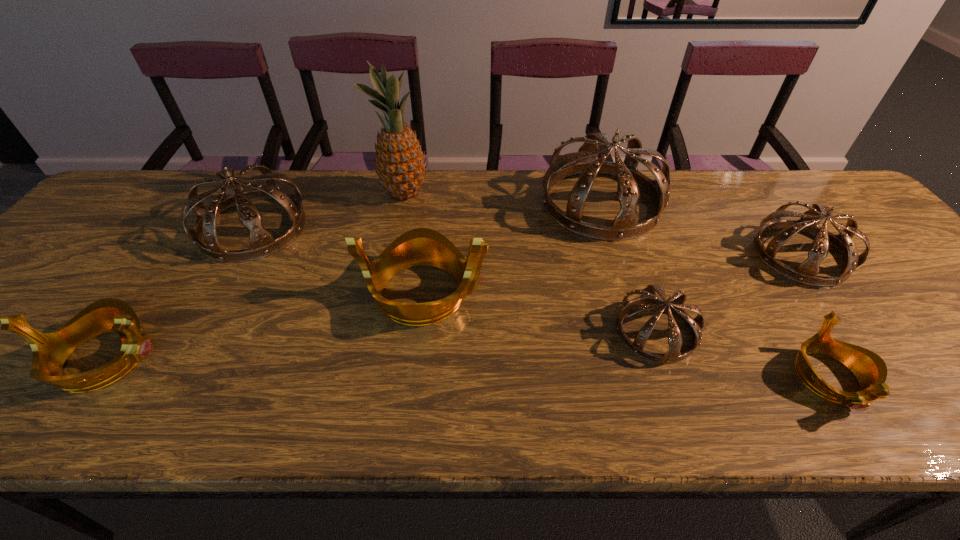
Locate an element on the screen. the rightmost gold tiara is located at coordinates (869, 368).

Locate an element on the screen. The image size is (960, 540). vacant space located on the left of the pineapple is located at coordinates (281, 194).

The height and width of the screenshot is (540, 960). I want to click on vacant space located on the front of the seventh shortest object, so click(621, 268).

Where is `free space located on the left of the leftmost brown tiara`? The width and height of the screenshot is (960, 540). free space located on the left of the leftmost brown tiara is located at coordinates (92, 228).

Locate an element on the screen. The width and height of the screenshot is (960, 540). vacant space located 0.240m at the front emblem of the biggest gold tiara is located at coordinates (590, 292).

The image size is (960, 540). Identify the location of vacant region located on the front of the rightmost brown tiara. (858, 333).

Find the location of a particular element. free point located at the front emblem of the leftmost gold tiara is located at coordinates (212, 358).

You are a GUI agent. You are given a task and a screenshot of the screen. Output one action in this format:
    pyautogui.click(x=<x>, y=<y>)
    Task: Click on the vacant space located 0.130m on the left of the smallest brown tiara
    The height and width of the screenshot is (540, 960).
    Given the screenshot: What is the action you would take?
    pyautogui.click(x=555, y=331)

Find the location of `pineapple that is at the far edge`. pineapple that is at the far edge is located at coordinates (400, 165).

Find the location of `object that is positioned at the right edge`. object that is positioned at the right edge is located at coordinates (805, 273).